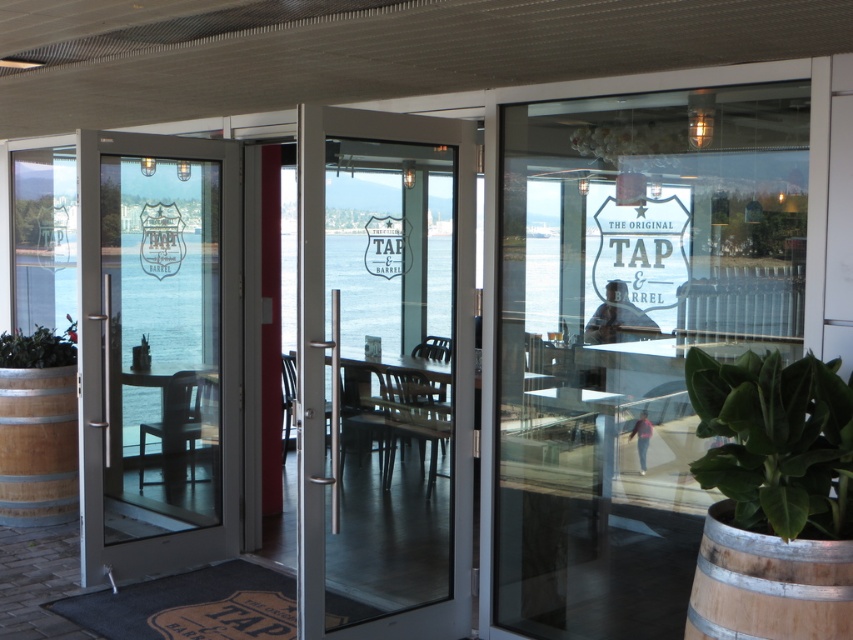
Question: From the image, what is the correct spatial relationship of wooden chair at center in relation to green leafy plant at lower left?

Choices:
 (A) right
 (B) left

Answer: (A)

Question: Which of the following is the closest to the observer?

Choices:
 (A) matte black chair at center
 (B) clear glass door at center

Answer: (B)

Question: Which of the following is the farthest from the observer?

Choices:
 (A) (419, 342)
 (B) (141, 460)
 (C) (798, 397)

Answer: (B)

Question: Can you confirm if transparent glass door at center is wider than wooden barrel at lower left?

Choices:
 (A) yes
 (B) no

Answer: (A)

Question: Does green leafy plant at lower right appear on the left side of wooden barrel at lower left?

Choices:
 (A) no
 (B) yes

Answer: (A)

Question: Which object is farther from the camera taking this photo?

Choices:
 (A) green leafy plant at lower right
 (B) wooden barrel at lower right
 (C) metallic silver chair at center

Answer: (C)